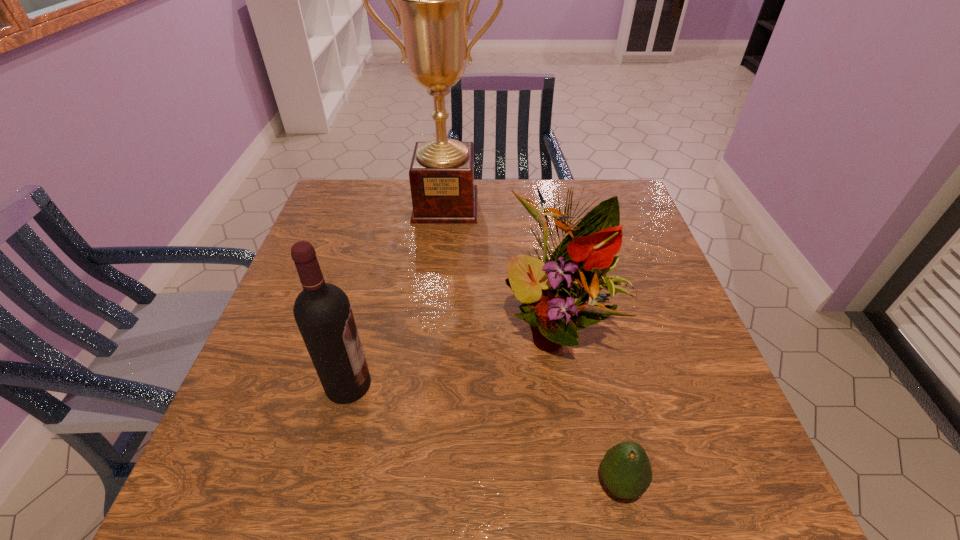
The height and width of the screenshot is (540, 960). I want to click on free region that satisfies the following two spatial constraints: 1. on the label of the wine bottle; 2. on the back side of the shortest object, so click(323, 484).

The height and width of the screenshot is (540, 960). Find the location of `blank space that satisfies the following two spatial constraints: 1. on the plaque of the trophy cup; 2. on the left side of the avocado`. blank space that satisfies the following two spatial constraints: 1. on the plaque of the trophy cup; 2. on the left side of the avocado is located at coordinates (418, 484).

At what (x,y) coordinates should I click in order to perform the action: click on free space that satisfies the following two spatial constraints: 1. on the front-facing side of the bouquet; 2. on the label of the wine bottle. Please return your answer as a coordinate pair (x, y). Looking at the image, I should click on (565, 384).

You are a GUI agent. You are given a task and a screenshot of the screen. Output one action in this format:
    pyautogui.click(x=<x>, y=<y>)
    Task: Click on the vacant space that satisfies the following two spatial constraints: 1. on the plaque of the farthest object; 2. on the label of the wine bottle
    
    Given the screenshot: What is the action you would take?
    pyautogui.click(x=427, y=384)

You are a GUI agent. You are given a task and a screenshot of the screen. Output one action in this format:
    pyautogui.click(x=<x>, y=<y>)
    Task: Click on the free space in the image that satisfies the following two spatial constraints: 1. on the front-facing side of the bouquet; 2. on the label of the wine bottle
    This screenshot has width=960, height=540.
    Given the screenshot: What is the action you would take?
    pyautogui.click(x=565, y=384)